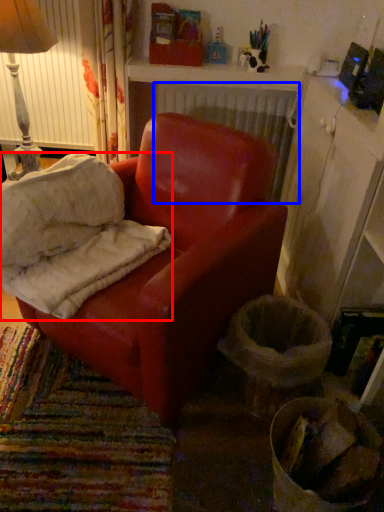
Question: Which object appears closest to the camera in this image, material (highlighted by a red box) or radiator (highlighted by a blue box)?

Choices:
 (A) material
 (B) radiator

Answer: (A)